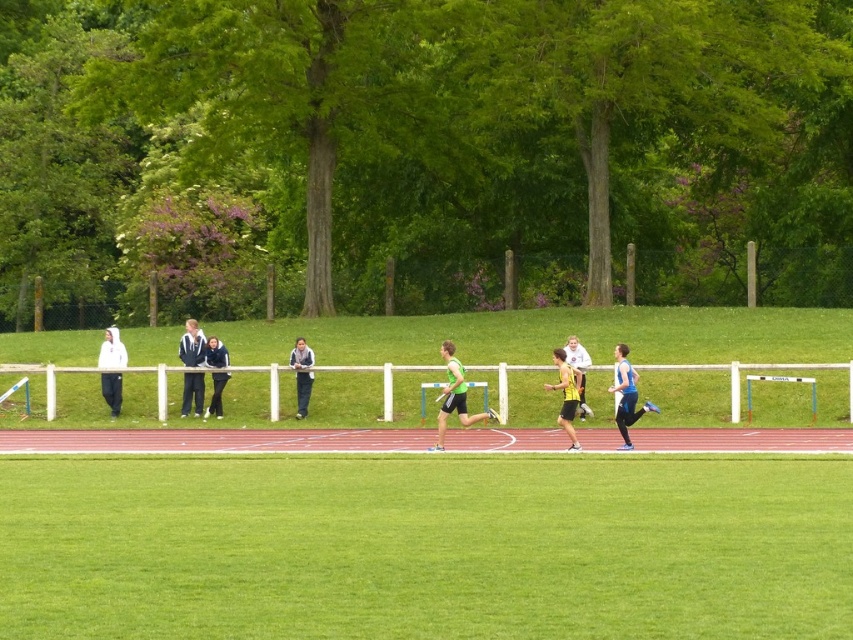
Question: Is green grass at center to the right of white matte hoodie at left from the viewer's perspective?

Choices:
 (A) yes
 (B) no

Answer: (A)

Question: Can you confirm if white plastic rail at center is wider than yellow-green athletic uniform at center?

Choices:
 (A) yes
 (B) no

Answer: (A)

Question: Which object is closer to the camera taking this photo?

Choices:
 (A) dark blue jacket at center
 (B) light blue athletic top at center
 (C) blue fabric jacket at center

Answer: (B)

Question: Is white matte hoodie at left to the right of dark gray sweater at center from the viewer's perspective?

Choices:
 (A) yes
 (B) no

Answer: (B)

Question: Among these points, which one is nearest to the camera?

Choices:
 (A) (534, 547)
 (B) (577, 388)
 (C) (461, 368)

Answer: (A)

Question: Which object appears closest to the camera in this image?

Choices:
 (A) light blue athletic top at center
 (B) blue fabric jacket at center
 (C) green grass at center
 (D) green matte hurdle at center

Answer: (C)